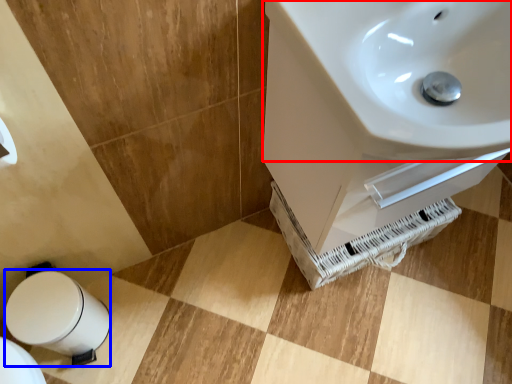
Question: Which object is closer to the camera taking this photo, sink (highlighted by a red box) or bidet (highlighted by a blue box)?

Choices:
 (A) sink
 (B) bidet

Answer: (A)